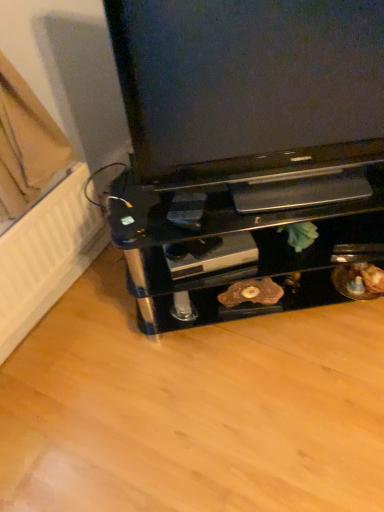
Where is `matte black television at center`? matte black television at center is located at coordinates (248, 85).

In the scene shown: In order to face matte black television at center, should I rotate leftwards or rightwards?

You should rotate right by 11.379 degrees.

What do you see at coordinates (248, 85) in the screenshot? I see `matte black television at center` at bounding box center [248, 85].

At what (x,y) coordinates should I click in order to perform the action: click on matte black television at center. Please return your answer as a coordinate pair (x, y). Looking at the image, I should click on (248, 85).